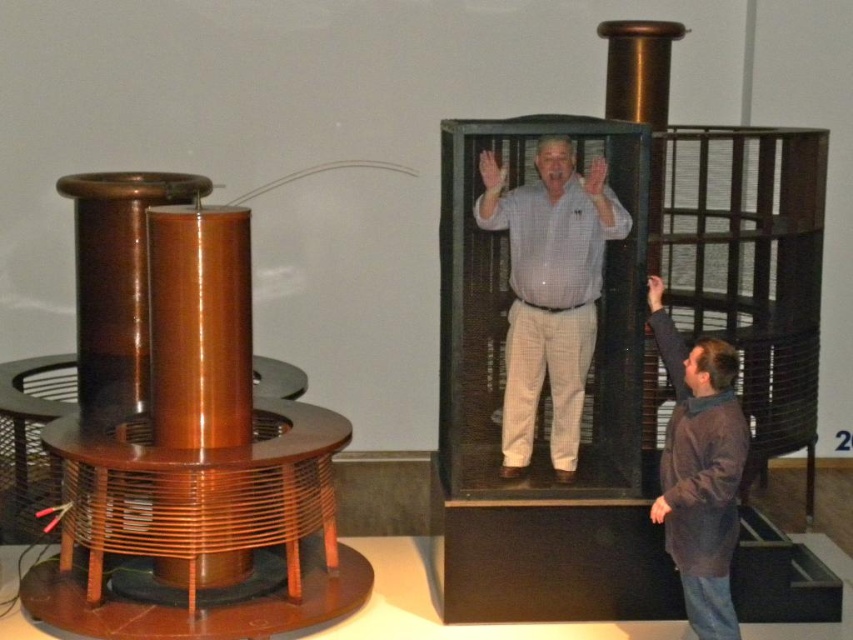
Does metallic grid cage at center appear on the left side of brown fuzzy sweater at lower right?

Incorrect, metallic grid cage at center is not on the left side of brown fuzzy sweater at lower right.

Does metallic grid cage at center appear under brown fuzzy sweater at lower right?

Incorrect, metallic grid cage at center is not positioned below brown fuzzy sweater at lower right.

Between point (723, 266) and point (709, 577), which one is positioned in front?

Point (709, 577)

Where is `metallic grid cage at center`? The height and width of the screenshot is (640, 853). metallic grid cage at center is located at coordinates (643, 289).

Looking at this image, who is positioned more to the left, metallic grid cage at center or light blue checkered shirt at center?

From the viewer's perspective, light blue checkered shirt at center appears more on the left side.

Which is below, metallic grid cage at center or light blue checkered shirt at center?

metallic grid cage at center is lower down.

Who is more forward, (473, 220) or (585, 248)?

Positioned in front is point (585, 248).

You are a GUI agent. You are given a task and a screenshot of the screen. Output one action in this format:
    pyautogui.click(x=<x>, y=<y>)
    Task: Click on the metallic grid cage at center
    The image size is (853, 640).
    Given the screenshot: What is the action you would take?
    pyautogui.click(x=643, y=289)

Who is positioned more to the right, light blue checkered shirt at center or brown fuzzy sweater at lower right?

From the viewer's perspective, brown fuzzy sweater at lower right appears more on the right side.

How much distance is there between light blue checkered shirt at center and brown fuzzy sweater at lower right?

light blue checkered shirt at center is 26.26 inches from brown fuzzy sweater at lower right.

Which is behind, point (596, 246) or point (706, 460)?

The point (596, 246) is behind.

Locate an element on the screen. This screenshot has width=853, height=640. light blue checkered shirt at center is located at coordinates (549, 291).